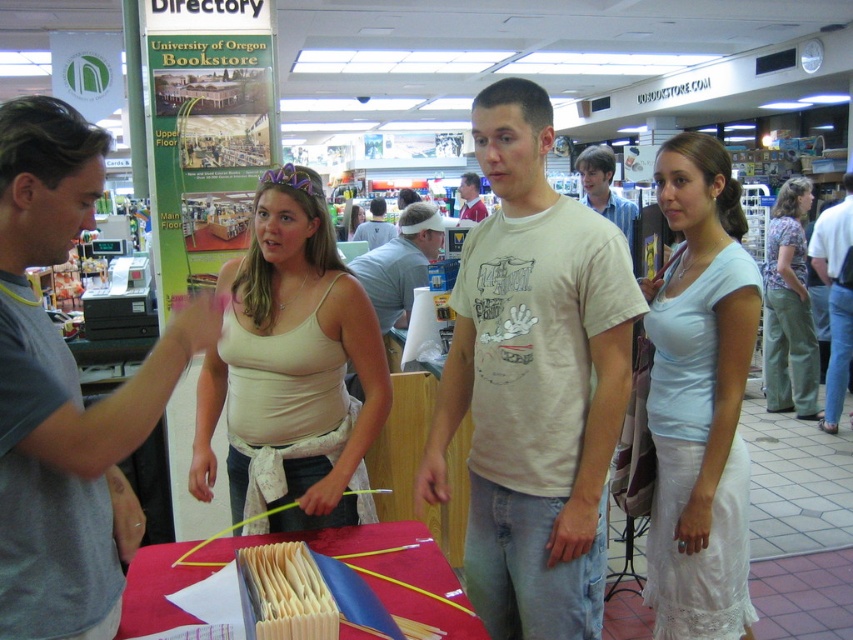
Between point (851, 228) and point (628, 225), which one is positioned behind?

Point (851, 228)

I want to click on jeans at center, so click(834, 298).

Can you confirm if printed floral blouse at center is taller than light gray t-shirt at center?

Yes, printed floral blouse at center is taller than light gray t-shirt at center.

Does printed floral blouse at center have a larger size compared to light gray t-shirt at center?

Actually, printed floral blouse at center might be smaller than light gray t-shirt at center.

This screenshot has width=853, height=640. I want to click on printed floral blouse at center, so click(x=788, y=307).

Between light blue cotton dress at center and matte white t-shirt at center, which one is positioned higher?

Positioned higher is matte white t-shirt at center.

Where is `light blue cotton dress at center`? Image resolution: width=853 pixels, height=640 pixels. light blue cotton dress at center is located at coordinates (700, 400).

You are a GUI agent. You are given a task and a screenshot of the screen. Output one action in this format:
    pyautogui.click(x=<x>, y=<y>)
    Task: Click on the light blue cotton dress at center
    
    Given the screenshot: What is the action you would take?
    pyautogui.click(x=700, y=400)